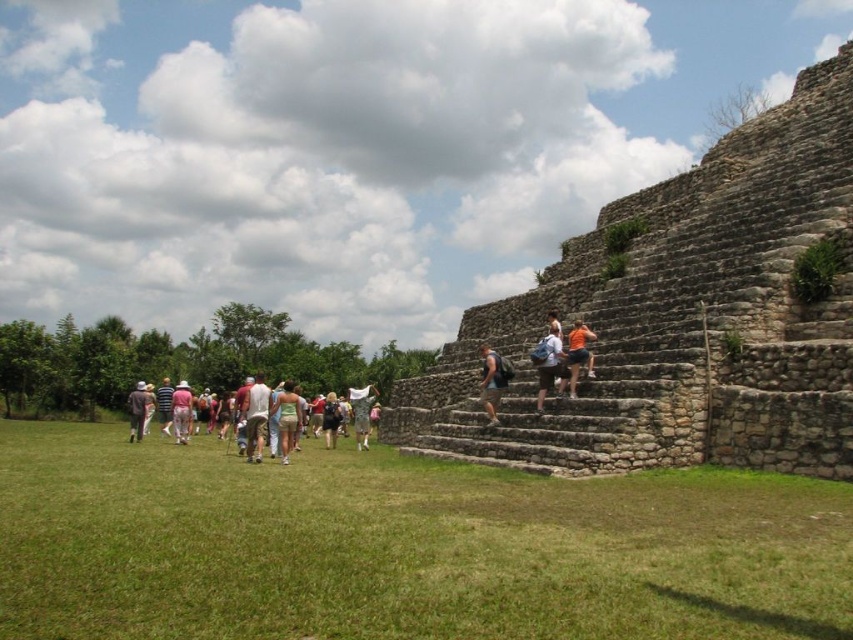
Question: Based on their relative distances, which object is nearer to the green fabric dress at center?

Choices:
 (A) white cotton dress at center
 (B) light brown fabric pants at lower left
 (C) matte brown backpack at center
 (D) light green fabric at center

Answer: (A)

Question: Which object appears farthest from the camera in this image?

Choices:
 (A) matte brown backpack at center
 (B) camouflage fabric at center
 (C) white cotton dress at center
 (D) light brown fabric pants at lower left

Answer: (D)

Question: Is green grass at lower left below camouflage fabric at center?

Choices:
 (A) no
 (B) yes

Answer: (A)

Question: Which point is farther to the camera?

Choices:
 (A) (142, 384)
 (B) (364, 422)
 (C) (291, 448)
 (D) (172, 413)

Answer: (A)

Question: Does green fabric dress at center have a greater width compared to light green fabric at center?

Choices:
 (A) no
 (B) yes

Answer: (B)

Question: Is green grass at lower left above orange cotton shirt at center?

Choices:
 (A) no
 (B) yes

Answer: (A)